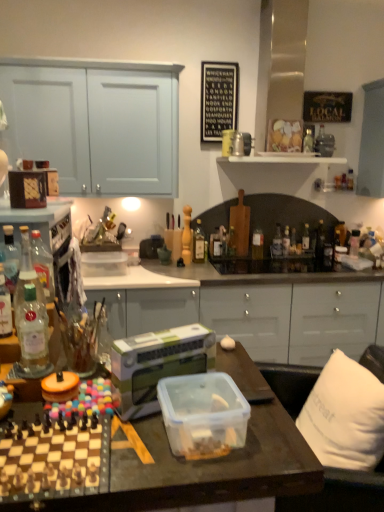
Locate an element on the screen. free spot to the right of translucent glass bottle at center, the 8th bottle in the front-to-back sequence is located at coordinates (281, 262).